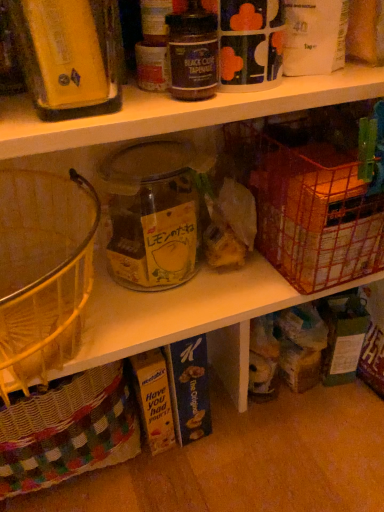
Locate an element on the screen. vacant area that is in front of transparent glass jar at center is located at coordinates coord(186,310).